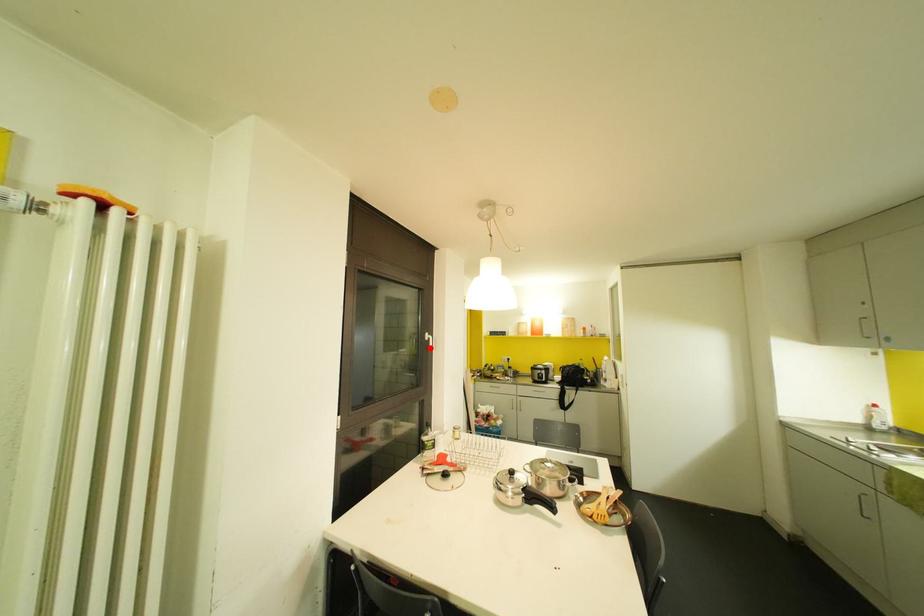
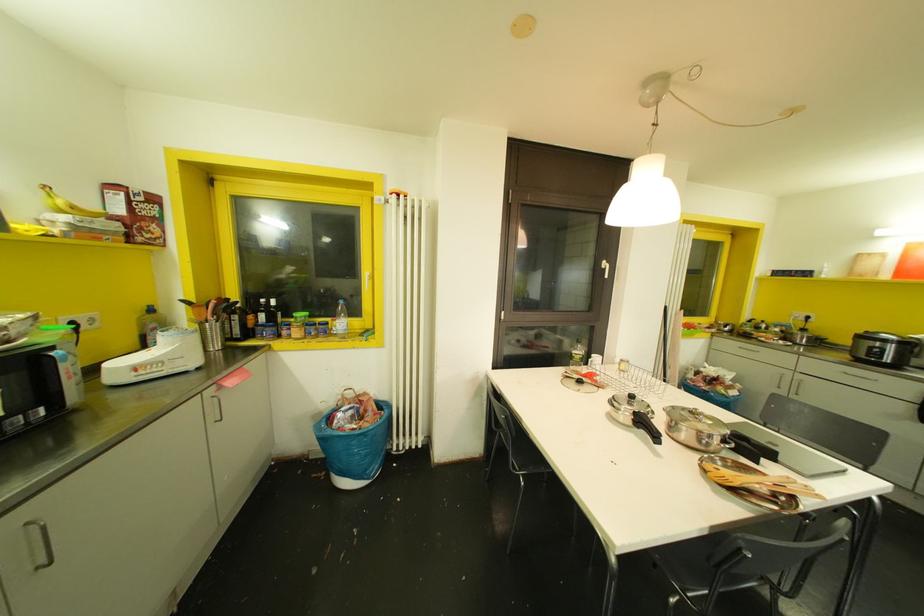
Locate, in the second image, the point that corresponds to the highlighted location in the first image.

(605, 276)